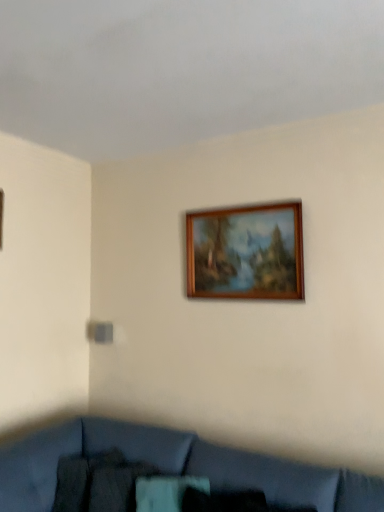
Question: From a real-world perspective, does velvet blue couch at lower center sit lower than wooden picture frame at upper center?

Choices:
 (A) no
 (B) yes

Answer: (B)

Question: Does velvet blue couch at lower center have a smaller size compared to wooden picture frame at upper center?

Choices:
 (A) yes
 (B) no

Answer: (B)

Question: From the image's perspective, is velvet blue couch at lower center located beneath wooden picture frame at upper center?

Choices:
 (A) yes
 (B) no

Answer: (A)

Question: Are velvet blue couch at lower center and wooden picture frame at upper center located far from each other?

Choices:
 (A) no
 (B) yes

Answer: (B)

Question: Can you confirm if velvet blue couch at lower center is thinner than wooden picture frame at upper center?

Choices:
 (A) no
 (B) yes

Answer: (A)

Question: Does velvet blue couch at lower center appear on the left side of wooden picture frame at upper center?

Choices:
 (A) no
 (B) yes

Answer: (B)

Question: Is wooden picture frame at upper center turned away from velvet blue couch at lower center?

Choices:
 (A) no
 (B) yes

Answer: (A)

Question: Could you tell me if wooden picture frame at upper center is turned towards velvet blue couch at lower center?

Choices:
 (A) no
 (B) yes

Answer: (A)

Question: Is wooden picture frame at upper center wider than velvet blue couch at lower center?

Choices:
 (A) no
 (B) yes

Answer: (A)

Question: Considering the relative sizes of wooden picture frame at upper center and velvet blue couch at lower center in the image provided, is wooden picture frame at upper center thinner than velvet blue couch at lower center?

Choices:
 (A) no
 (B) yes

Answer: (B)

Question: From the image's perspective, is wooden picture frame at upper center below velvet blue couch at lower center?

Choices:
 (A) no
 (B) yes

Answer: (A)

Question: From a real-world perspective, is wooden picture frame at upper center over velvet blue couch at lower center?

Choices:
 (A) no
 (B) yes

Answer: (B)

Question: Is wooden picture frame at upper center wider or thinner than velvet blue couch at lower center?

Choices:
 (A) thin
 (B) wide

Answer: (A)